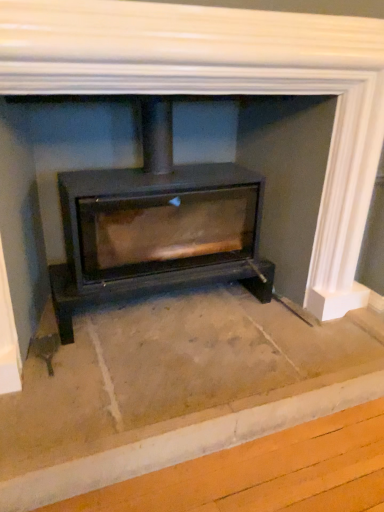
This screenshot has width=384, height=512. What are the coordinates of `matte black wood burning stove at center` in the screenshot? It's located at (157, 226).

What do you see at coordinates (157, 226) in the screenshot? I see `matte black wood burning stove at center` at bounding box center [157, 226].

Image resolution: width=384 pixels, height=512 pixels. Identify the location of matte black wood burning stove at center. (157, 226).